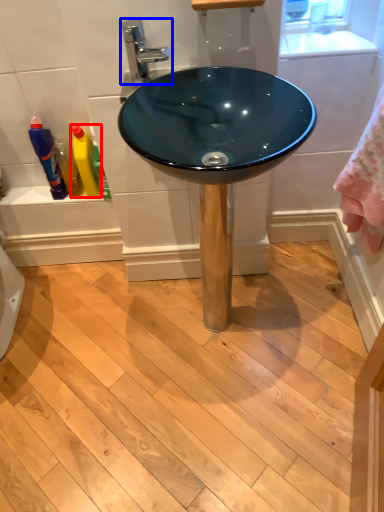
Question: Which object is further to the camera taking this photo, cleaning product (highlighted by a red box) or tap (highlighted by a blue box)?

Choices:
 (A) cleaning product
 (B) tap

Answer: (A)